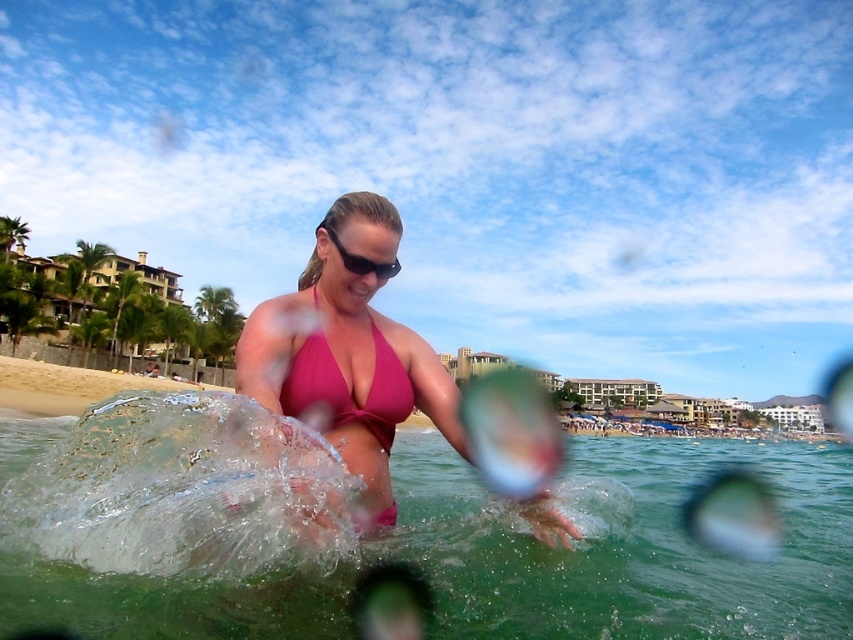
Question: Which point is farther from the camera taking this photo?

Choices:
 (A) (409, 394)
 (B) (386, 268)
 (C) (306, 296)
 (D) (788, 628)

Answer: (C)

Question: Is pink matte bikini top at center to the right of black plastic sunglasses at center from the viewer's perspective?

Choices:
 (A) yes
 (B) no

Answer: (B)

Question: Is clear water at center wider than pink matte bikini at center?

Choices:
 (A) yes
 (B) no

Answer: (A)

Question: Can you confirm if pink matte bikini at center is thinner than black plastic sunglasses at center?

Choices:
 (A) no
 (B) yes

Answer: (A)

Question: Among these objects, which one is farthest from the camera?

Choices:
 (A) pink matte bikini at center
 (B) pink matte bikini top at center
 (C) black plastic sunglasses at center

Answer: (B)

Question: Which is farther from the pink matte bikini top at center?

Choices:
 (A) black plastic sunglasses at center
 (B) pink matte bikini at center
 (C) clear water at center

Answer: (C)